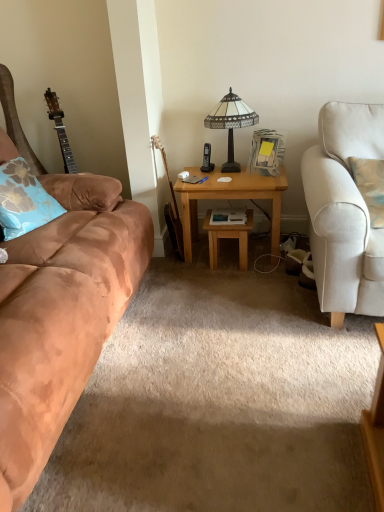
This screenshot has height=512, width=384. Find the location of `vacant area that is in front of wooden table at center`. vacant area that is in front of wooden table at center is located at coordinates (241, 281).